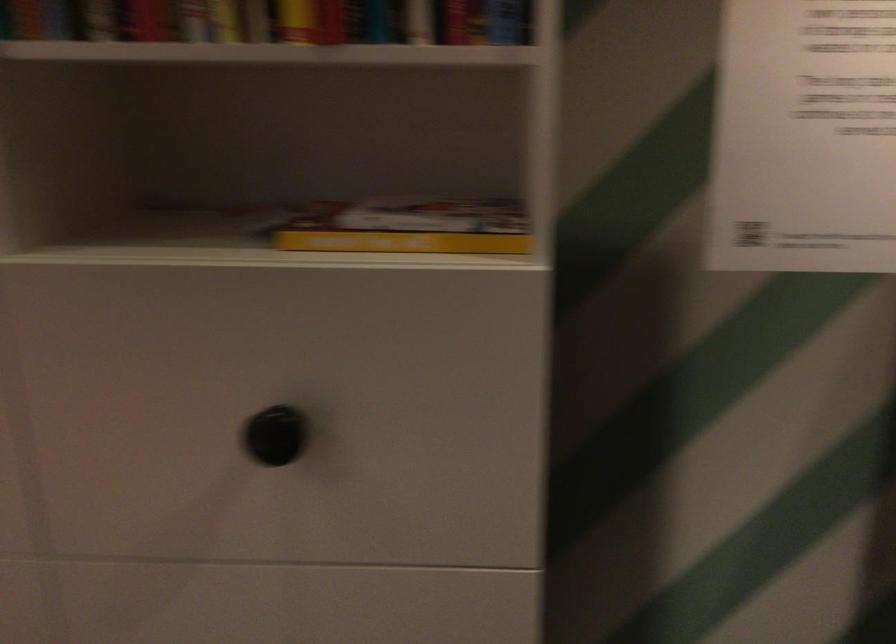
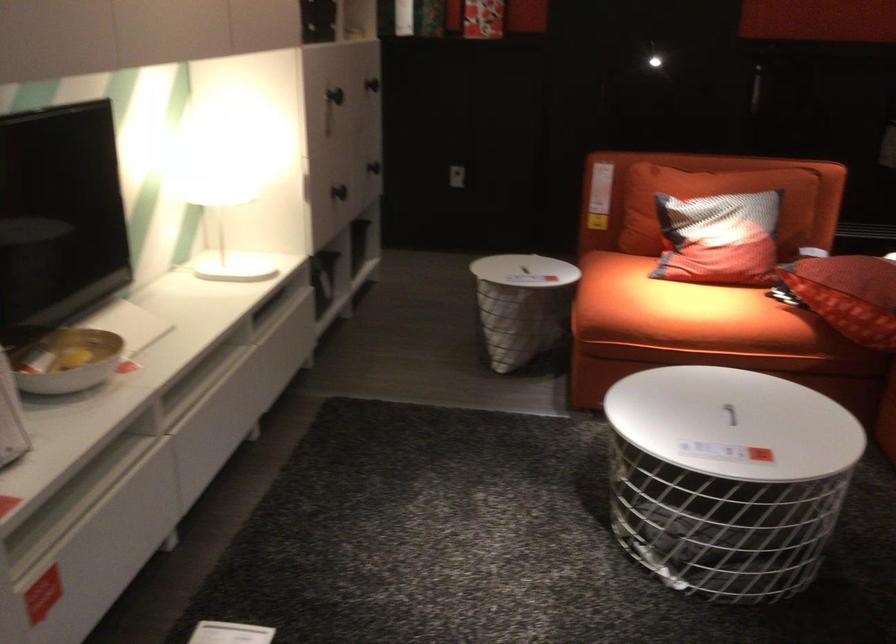
Locate, in the second image, the point that corresponds to (x=311, y=464) in the first image.

(372, 84)